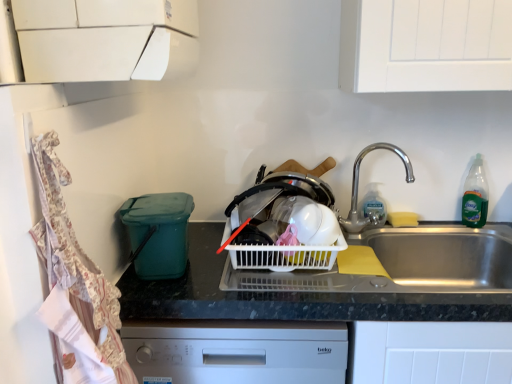
Measure the distance between teal plastic bin at left and camera.

teal plastic bin at left and camera are 1.13 meters apart from each other.

What do you see at coordinates (276, 224) in the screenshot?
I see `white plastic basket at center` at bounding box center [276, 224].

This screenshot has height=384, width=512. Describe the element at coordinates (475, 196) in the screenshot. I see `green translucent bottle at right, arranged as the 2th bottle when viewed from the left` at that location.

Locate an element on the screen. The image size is (512, 384). silver metallic faucet at upper right is located at coordinates (358, 186).

What do you see at coordinates (77, 260) in the screenshot? I see `teal plastic bin at left` at bounding box center [77, 260].

Find the location of a particular element. teal plastic bin at left is located at coordinates (158, 233).

Based on their positions, is silver metallic faucet at upper right located to the left or right of clear plastic soap dispenser at sink right, marked as the 1th bottle in a left-to-right arrangement?

From the image, it's evident that silver metallic faucet at upper right is to the left of clear plastic soap dispenser at sink right, marked as the 1th bottle in a left-to-right arrangement.

Which of these two, silver metallic faucet at upper right or clear plastic soap dispenser at sink right, positioned as the second bottle in right-to-left order, is wider?

silver metallic faucet at upper right is wider.

How different are the orientations of silver metallic faucet at upper right and clear plastic soap dispenser at sink right, positioned as the second bottle in right-to-left order, in degrees?

There is a 0.000787-degree angle between the facing directions of silver metallic faucet at upper right and clear plastic soap dispenser at sink right, positioned as the second bottle in right-to-left order.

Is silver metallic faucet at upper right beside clear plastic soap dispenser at sink right, positioned as the second bottle in right-to-left order?

Absolutely, silver metallic faucet at upper right is next to and touching clear plastic soap dispenser at sink right, positioned as the second bottle in right-to-left order.

Between teal plastic bin at left and silver metallic faucet at upper right, which one appears on the right side from the viewer's perspective?

silver metallic faucet at upper right.

Is teal plastic bin at left far away from silver metallic faucet at upper right?

No, teal plastic bin at left is in close proximity to silver metallic faucet at upper right.

Is teal plastic bin at left wider or thinner than silver metallic faucet at upper right?

Considering their sizes, teal plastic bin at left looks broader than silver metallic faucet at upper right.

Is teal plastic bin at left smaller than silver metallic faucet at upper right?

No, teal plastic bin at left is not smaller than silver metallic faucet at upper right.

Is clear plastic soap dispenser at sink right, positioned as the second bottle in right-to-left order, bigger or smaller than green translucent bottle at right, placed as the 1th bottle when sorted from right to left?

clear plastic soap dispenser at sink right, positioned as the second bottle in right-to-left order, is smaller than green translucent bottle at right, placed as the 1th bottle when sorted from right to left.

From a real-world perspective, does clear plastic soap dispenser at sink right, marked as the 1th bottle in a left-to-right arrangement, stand above green translucent bottle at right, placed as the 1th bottle when sorted from right to left?

Actually, clear plastic soap dispenser at sink right, marked as the 1th bottle in a left-to-right arrangement, is physically below green translucent bottle at right, placed as the 1th bottle when sorted from right to left, in the real world.

Are clear plastic soap dispenser at sink right, marked as the 1th bottle in a left-to-right arrangement, and green translucent bottle at right, arranged as the 2th bottle when viewed from the left, located far from each other?

clear plastic soap dispenser at sink right, marked as the 1th bottle in a left-to-right arrangement, is near green translucent bottle at right, arranged as the 2th bottle when viewed from the left, not far away.

Is green translucent bottle at right, placed as the 1th bottle when sorted from right to left, completely or partially inside clear plastic soap dispenser at sink right, marked as the 1th bottle in a left-to-right arrangement?

Definitely not — green translucent bottle at right, placed as the 1th bottle when sorted from right to left, is not inside clear plastic soap dispenser at sink right, marked as the 1th bottle in a left-to-right arrangement.

Is teal plastic bin at left oriented away from white plastic basket at center?

No.

Is teal plastic bin at left beside white plastic basket at center?

No, teal plastic bin at left is not next to white plastic basket at center.

Is teal plastic bin at left at the right side of white plastic basket at center?

No, teal plastic bin at left is not to the right of white plastic basket at center.

Considering the relative sizes of clear plastic soap dispenser at sink right, marked as the 1th bottle in a left-to-right arrangement, and teal plastic bin at left in the image provided, is clear plastic soap dispenser at sink right, marked as the 1th bottle in a left-to-right arrangement, wider than teal plastic bin at left?

No, clear plastic soap dispenser at sink right, marked as the 1th bottle in a left-to-right arrangement, is not wider than teal plastic bin at left.

Does clear plastic soap dispenser at sink right, marked as the 1th bottle in a left-to-right arrangement, have a smaller size compared to teal plastic bin at left?

Yes.

In the scene shown: Can you confirm if clear plastic soap dispenser at sink right, positioned as the second bottle in right-to-left order, is shorter than teal plastic bin at left?

Yes, clear plastic soap dispenser at sink right, positioned as the second bottle in right-to-left order, is shorter than teal plastic bin at left.

Where is `material above the clear plastic soap dispenser at sink right, positioned as the second bottle in right-to-left order (from a real-world perspective)`? material above the clear plastic soap dispenser at sink right, positioned as the second bottle in right-to-left order (from a real-world perspective) is located at coordinates (77, 260).

Can you confirm if black plastic container at left is thinner than teal plastic bin at left?

No.

Locate an element on the screen. Image resolution: width=512 pixels, height=384 pixels. countertop in front of the teal plastic bin at left is located at coordinates (343, 281).

Would you say black plastic container at left is inside or outside teal plastic bin at left?

black plastic container at left is outside teal plastic bin at left.

I want to click on basket container on the left of clear plastic soap dispenser at sink right, marked as the 1th bottle in a left-to-right arrangement, so click(x=276, y=224).

Is white plastic basket at center wider or thinner than clear plastic soap dispenser at sink right, marked as the 1th bottle in a left-to-right arrangement?

In the image, white plastic basket at center appears to be wider than clear plastic soap dispenser at sink right, marked as the 1th bottle in a left-to-right arrangement.

Between white plastic basket at center and clear plastic soap dispenser at sink right, marked as the 1th bottle in a left-to-right arrangement, which one appears on the left side from the viewer's perspective?

white plastic basket at center.

I want to click on bottle that is the 2nd object directly below the silver metallic faucet at upper right (from a real-world perspective), so click(x=373, y=205).

You are a GUI agent. You are given a task and a screenshot of the screen. Output one action in this format:
    pyautogui.click(x=<x>, y=<y>)
    Task: Click on the material in front of the silver metallic faucet at upper right
    This screenshot has height=384, width=512.
    Given the screenshot: What is the action you would take?
    pyautogui.click(x=77, y=260)

Estimate the real-world distances between objects in this image. Which object is closer to black plastic container at left, clear plastic soap dispenser at sink right, positioned as the second bottle in right-to-left order, or teal plastic bin at left?

teal plastic bin at left.

When comparing their distances from white plastic basket at center, does silver metallic faucet at upper right or green translucent bottle at right, placed as the 1th bottle when sorted from right to left, seem further?

Among the two, green translucent bottle at right, placed as the 1th bottle when sorted from right to left, is located further to white plastic basket at center.

Based on the photo, based on their spatial positions, is teal plastic bin at left or clear plastic soap dispenser at sink right, marked as the 1th bottle in a left-to-right arrangement, further from teal plastic bin at left?

clear plastic soap dispenser at sink right, marked as the 1th bottle in a left-to-right arrangement, is further to teal plastic bin at left.

Estimate the real-world distances between objects in this image. Which object is further from white plastic basket at center, teal plastic bin at left or black plastic container at left?

Based on the image, teal plastic bin at left appears to be further to white plastic basket at center.

Considering their positions, is green translucent bottle at right, arranged as the 2th bottle when viewed from the left, positioned closer to silver metallic faucet at upper right than teal plastic bin at left?

Among the two, green translucent bottle at right, arranged as the 2th bottle when viewed from the left, is located nearer to silver metallic faucet at upper right.

Considering their positions, is green translucent bottle at right, placed as the 1th bottle when sorted from right to left, positioned closer to silver metallic faucet at upper right than black plastic container at left?

green translucent bottle at right, placed as the 1th bottle when sorted from right to left, is closer to silver metallic faucet at upper right.

Considering their positions, is green translucent bottle at right, placed as the 1th bottle when sorted from right to left, positioned closer to black plastic container at left than silver metallic faucet at upper right?

silver metallic faucet at upper right.

Looking at the image, which one is located further to clear plastic soap dispenser at sink right, marked as the 1th bottle in a left-to-right arrangement, white plastic basket at center or green translucent bottle at right, arranged as the 2th bottle when viewed from the left?

Among the two, white plastic basket at center is located further to clear plastic soap dispenser at sink right, marked as the 1th bottle in a left-to-right arrangement.

I want to click on tap located between teal plastic bin at left and green translucent bottle at right, arranged as the 2th bottle when viewed from the left, in the left-right direction, so click(358, 186).

Where is `countertop between teal plastic bin at left and silver metallic faucet at upper right`? Image resolution: width=512 pixels, height=384 pixels. countertop between teal plastic bin at left and silver metallic faucet at upper right is located at coordinates (343, 281).

At what (x,y) coordinates should I click in order to perform the action: click on appliance between teal plastic bin at left and silver metallic faucet at upper right. Please return your answer as a coordinate pair (x, y). The width and height of the screenshot is (512, 384). Looking at the image, I should click on (158, 233).

You are a GUI agent. You are given a task and a screenshot of the screen. Output one action in this format:
    pyautogui.click(x=<x>, y=<y>)
    Task: Click on the tap positioned between white plastic basket at center and clear plastic soap dispenser at sink right, positioned as the second bottle in right-to-left order, from near to far
    Image resolution: width=512 pixels, height=384 pixels.
    Given the screenshot: What is the action you would take?
    pyautogui.click(x=358, y=186)